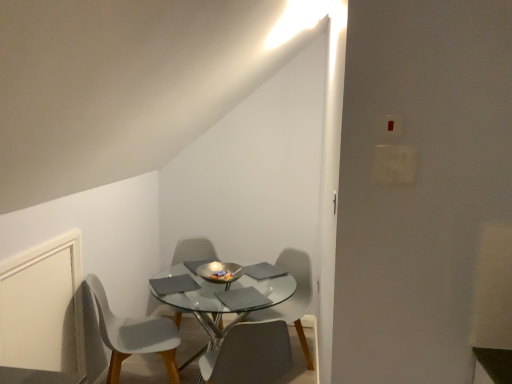
Question: Could you tell me if matte gray chair at center, positioned as the 3th chair in left-to-right order, is turned towards white plastic chair at center, acting as the second chair starting from the left?

Choices:
 (A) no
 (B) yes

Answer: (B)

Question: From a real-world perspective, is matte gray chair at center, positioned as the 3th chair in left-to-right order, on white plastic chair at center, acting as the second chair starting from the left?

Choices:
 (A) yes
 (B) no

Answer: (A)

Question: Is matte gray chair at center, positioned as the 3th chair in left-to-right order, further to the viewer compared to white plastic chair at center, which ranks as the third chair in right-to-left order?

Choices:
 (A) no
 (B) yes

Answer: (A)

Question: From the image's perspective, does matte gray chair at center, which ranks as the second chair in right-to-left order, appear higher than white plastic chair at center, which ranks as the third chair in right-to-left order?

Choices:
 (A) no
 (B) yes

Answer: (A)

Question: Is matte gray chair at center, which ranks as the second chair in right-to-left order, next to white plastic chair at center, which ranks as the third chair in right-to-left order, and touching it?

Choices:
 (A) yes
 (B) no

Answer: (B)

Question: From a real-world perspective, relative to white plastic chair at lower left, which is the 1th chair in left-to-right order, is matte gray chair at center, which ranks as the second chair in right-to-left order, vertically above or below?

Choices:
 (A) above
 (B) below

Answer: (A)

Question: Is matte gray chair at center, positioned as the 3th chair in left-to-right order, in front of or behind white plastic chair at lower left, which is the 1th chair in left-to-right order, in the image?

Choices:
 (A) behind
 (B) front

Answer: (B)

Question: From their relative heights in the image, would you say matte gray chair at center, which ranks as the second chair in right-to-left order, is taller or shorter than white plastic chair at lower left, which is the 1th chair in left-to-right order?

Choices:
 (A) tall
 (B) short

Answer: (B)

Question: Considering the positions of matte gray chair at center, positioned as the 3th chair in left-to-right order, and white plastic chair at lower left, which is the 1th chair in left-to-right order, in the image, is matte gray chair at center, positioned as the 3th chair in left-to-right order, wider or thinner than white plastic chair at lower left, which is the 1th chair in left-to-right order,?

Choices:
 (A) wide
 (B) thin

Answer: (B)

Question: Looking at the image, does transparent glass table at center seem bigger or smaller compared to white plastic light switch at upper right?

Choices:
 (A) big
 (B) small

Answer: (A)

Question: Considering the positions of transparent glass table at center and white plastic light switch at upper right in the image, is transparent glass table at center taller or shorter than white plastic light switch at upper right?

Choices:
 (A) tall
 (B) short

Answer: (A)

Question: In the image, is transparent glass table at center on the left side or the right side of white plastic light switch at upper right?

Choices:
 (A) left
 (B) right

Answer: (A)

Question: Is point (202, 316) positioned closer to the camera than point (410, 150)?

Choices:
 (A) farther
 (B) closer

Answer: (A)

Question: Looking at the image, does white plastic chair at lower left, the fourth chair when ordered from right to left, seem bigger or smaller compared to matte gray chair at center, which ranks as the 4th chair in left-to-right order?

Choices:
 (A) big
 (B) small

Answer: (A)

Question: Choose the correct answer: Is white plastic chair at lower left, the fourth chair when ordered from right to left, inside matte gray chair at center, the first chair viewed from the right, or outside it?

Choices:
 (A) outside
 (B) inside

Answer: (A)